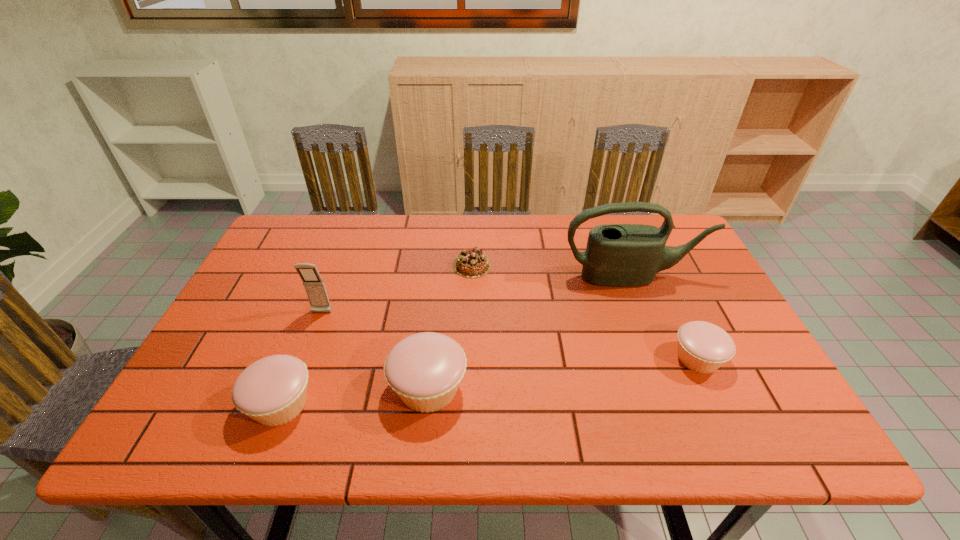
Image resolution: width=960 pixels, height=540 pixels. I want to click on object positioned at the near right corner, so click(x=703, y=347).

Image resolution: width=960 pixels, height=540 pixels. I want to click on vacant space at the far edge of the desktop, so click(496, 225).

This screenshot has width=960, height=540. What are the coordinates of `vacant space at the near edge` in the screenshot? It's located at (334, 374).

Find the location of a particular element. The image size is (960, 540). free region at the left edge of the desktop is located at coordinates (291, 266).

In the image, there is a desktop. Find the location of `vacant space at the right edge`. vacant space at the right edge is located at coordinates (683, 320).

In the image, there is a desktop. Where is `free region at the far left corner`? The height and width of the screenshot is (540, 960). free region at the far left corner is located at coordinates (317, 244).

Locate an element on the screen. The image size is (960, 540). free region at the far right corner of the desktop is located at coordinates (677, 221).

At what (x,y) coordinates should I click in order to perform the action: click on free space between the tallest object and the rightmost cupcake. Please return your answer as a coordinate pair (x, y). The image size is (960, 540). Looking at the image, I should click on (665, 318).

The image size is (960, 540). I want to click on unoccupied position between the second cupcake from right to left and the tallest object, so click(530, 332).

The height and width of the screenshot is (540, 960). Find the location of `free space that is in between the leftmost cupcake and the second cupcake from left to right`. free space that is in between the leftmost cupcake and the second cupcake from left to right is located at coordinates (354, 396).